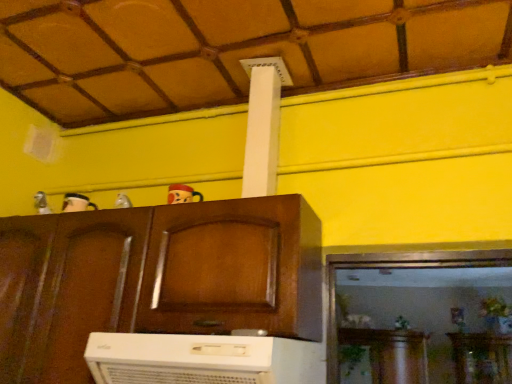
Find the location of a particular element. The height and width of the screenshot is (384, 512). matte plastic toy at upper center, the first toy when ordered from right to left is located at coordinates (182, 194).

What do you see at coordinates (230, 49) in the screenshot?
I see `wooden ceiling at upper center` at bounding box center [230, 49].

This screenshot has width=512, height=384. I want to click on wooden ceiling at upper center, so click(230, 49).

Where is `wooden cabinet at center`? This screenshot has height=384, width=512. wooden cabinet at center is located at coordinates (153, 278).

You are a GUI agent. You are given a task and a screenshot of the screen. Output one action in this format:
    pyautogui.click(x=<x>, y=<y>)
    Task: Click on the white plastic air conditioner at lower center
    
    Given the screenshot: What is the action you would take?
    pyautogui.click(x=202, y=359)

In order to face white plastic air conditioner at lower center, should I rotate leftwards or rightwards?

To face it directly, rotate left by 5.889 degrees.

Find the location of a particular element. The width and height of the screenshot is (512, 384). matte plastic toy at upper center, marked as the second toy in a left-to-right arrangement is located at coordinates tap(182, 194).

Could matte plastic toy at upper center, marked as the second toy in a left-to-right arrangement, be considered to be inside wooden ceiling at upper center?

No, matte plastic toy at upper center, marked as the second toy in a left-to-right arrangement, is located outside of wooden ceiling at upper center.

In the image, is wooden ceiling at upper center positioned in front of or behind matte plastic toy at upper center, marked as the second toy in a left-to-right arrangement?

In the image, wooden ceiling at upper center appears in front of matte plastic toy at upper center, marked as the second toy in a left-to-right arrangement.

Which is farther, (51, 49) or (174, 198)?

The point (174, 198) is behind.

Looking at this image, who is shorter, wooden ceiling at upper center or matte plastic toy at upper center, the first toy when ordered from right to left?

Standing shorter between the two is matte plastic toy at upper center, the first toy when ordered from right to left.

Which object is positioned more to the left, white plastic air conditioner at lower center or metallic silver toy at upper center, acting as the first toy starting from the left?

metallic silver toy at upper center, acting as the first toy starting from the left, is more to the left.

Can you confirm if white plastic air conditioner at lower center is smaller than metallic silver toy at upper center, acting as the first toy starting from the left?

Actually, white plastic air conditioner at lower center might be larger than metallic silver toy at upper center, acting as the first toy starting from the left.

Who is more distant, white plastic air conditioner at lower center or metallic silver toy at upper center, acting as the first toy starting from the left?

metallic silver toy at upper center, acting as the first toy starting from the left, is more distant.

From the picture: How far apart are wooden ceiling at upper center and metallic silver toy at upper center, acting as the first toy starting from the left?

33.19 inches.

Looking at this image, is there a large distance between wooden ceiling at upper center and metallic silver toy at upper center, acting as the first toy starting from the left?

They are positioned close to each other.

Does wooden ceiling at upper center have a greater width compared to metallic silver toy at upper center, acting as the first toy starting from the left?

Correct, the width of wooden ceiling at upper center exceeds that of metallic silver toy at upper center, acting as the first toy starting from the left.

Find the location of a particular element. tile roof lying on the right of metallic silver toy at upper center, acting as the first toy starting from the left is located at coordinates (230, 49).

Which object is closer to the camera, wooden cabinet at center or wooden ceiling at upper center?

wooden cabinet at center.

Between wooden cabinet at center and wooden ceiling at upper center, which one has less height?

wooden ceiling at upper center is shorter.

Considering the positions of objects wooden cabinet at center and wooden ceiling at upper center in the image provided, who is more to the left, wooden cabinet at center or wooden ceiling at upper center?

wooden cabinet at center.

Image resolution: width=512 pixels, height=384 pixels. Identify the location of tile roof above the wooden cabinet at center (from a real-world perspective). [230, 49].

Who is smaller, metallic silver toy at upper center, which ranks as the second toy in right-to-left order, or wooden cabinet at center?

metallic silver toy at upper center, which ranks as the second toy in right-to-left order.

How many degrees apart are the facing directions of metallic silver toy at upper center, acting as the first toy starting from the left, and wooden cabinet at center?

0.00194 degrees.

Could you tell me if metallic silver toy at upper center, which ranks as the second toy in right-to-left order, is turned towards wooden cabinet at center?

No, metallic silver toy at upper center, which ranks as the second toy in right-to-left order, is not oriented towards wooden cabinet at center.

Can we say metallic silver toy at upper center, which ranks as the second toy in right-to-left order, lies outside wooden cabinet at center?

Indeed, metallic silver toy at upper center, which ranks as the second toy in right-to-left order, is completely outside wooden cabinet at center.

Does point (217, 67) appear closer or farther from the camera than point (189, 339)?

Clearly, point (217, 67) is more distant from the camera than point (189, 339).

Is wooden ceiling at upper center placed right next to white plastic air conditioner at lower center?

No, wooden ceiling at upper center is not beside white plastic air conditioner at lower center.

Between wooden ceiling at upper center and white plastic air conditioner at lower center, which one has larger width?

wooden ceiling at upper center.

Is wooden ceiling at upper center not within white plastic air conditioner at lower center?

Yes.

Based on the photo, between matte plastic toy at upper center, the first toy when ordered from right to left, and wooden cabinet at center, which one appears on the right side from the viewer's perspective?

matte plastic toy at upper center, the first toy when ordered from right to left.

Which object is thinner, matte plastic toy at upper center, marked as the second toy in a left-to-right arrangement, or wooden cabinet at center?

With smaller width is matte plastic toy at upper center, marked as the second toy in a left-to-right arrangement.

How many degrees apart are the facing directions of matte plastic toy at upper center, the first toy when ordered from right to left, and wooden cabinet at center?

The angle between the facing direction of matte plastic toy at upper center, the first toy when ordered from right to left, and the facing direction of wooden cabinet at center is 0.000503 degrees.

Does point (177, 199) lie in front of point (46, 283)?

No, (177, 199) is behind (46, 283).

Image resolution: width=512 pixels, height=384 pixels. Identify the location of toy that is the 1st one when counting backward from the wooden ceiling at upper center. (182, 194).

Locate an element on the screen. This screenshot has height=384, width=512. toy that is the 1st one when counting upward from the white plastic air conditioner at lower center (from the image's perspective) is located at coordinates (123, 201).

Estimate the real-world distances between objects in this image. Which object is closer to metallic silver toy at upper center, acting as the first toy starting from the left, wooden cabinet at center or matte plastic toy at upper center, marked as the second toy in a left-to-right arrangement?

Based on the image, matte plastic toy at upper center, marked as the second toy in a left-to-right arrangement, appears to be nearer to metallic silver toy at upper center, acting as the first toy starting from the left.

Estimate the real-world distances between objects in this image. Which object is further from matte plastic toy at upper center, the first toy when ordered from right to left, wooden cabinet at center or wooden ceiling at upper center?

wooden ceiling at upper center is further to matte plastic toy at upper center, the first toy when ordered from right to left.

When comparing their distances from metallic silver toy at upper center, acting as the first toy starting from the left, does wooden ceiling at upper center or matte plastic toy at upper center, the first toy when ordered from right to left, seem further?

wooden ceiling at upper center is further to metallic silver toy at upper center, acting as the first toy starting from the left.

Looking at the image, which one is located closer to wooden cabinet at center, metallic silver toy at upper center, acting as the first toy starting from the left, or wooden ceiling at upper center?

Based on the image, metallic silver toy at upper center, acting as the first toy starting from the left, appears to be nearer to wooden cabinet at center.

Based on their spatial positions, is white plastic air conditioner at lower center or matte plastic toy at upper center, marked as the second toy in a left-to-right arrangement, further from metallic silver toy at upper center, acting as the first toy starting from the left?

Based on the image, white plastic air conditioner at lower center appears to be further to metallic silver toy at upper center, acting as the first toy starting from the left.

Based on their spatial positions, is wooden ceiling at upper center or metallic silver toy at upper center, which ranks as the second toy in right-to-left order, further from wooden cabinet at center?

The object further to wooden cabinet at center is wooden ceiling at upper center.

From the image, which object appears to be farther from wooden ceiling at upper center, wooden cabinet at center or white plastic air conditioner at lower center?

white plastic air conditioner at lower center is positioned further to the anchor wooden ceiling at upper center.

From the image, which object appears to be farther from wooden ceiling at upper center, matte plastic toy at upper center, the first toy when ordered from right to left, or white plastic air conditioner at lower center?

The object further to wooden ceiling at upper center is white plastic air conditioner at lower center.

What are the coordinates of `cabinetry between white plastic air conditioner at lower center and metallic silver toy at upper center, acting as the first toy starting from the left, from front to back` in the screenshot? It's located at (153, 278).

At what (x,y) coordinates should I click in order to perform the action: click on toy between wooden ceiling at upper center and metallic silver toy at upper center, which ranks as the second toy in right-to-left order, in the vertical direction. Please return your answer as a coordinate pair (x, y). Looking at the image, I should click on (182, 194).

Identify the location of cabinetry between wooden ceiling at upper center and white plastic air conditioner at lower center in the up-down direction. (153, 278).

At what (x,y) coordinates should I click in order to perform the action: click on toy between white plastic air conditioner at lower center and metallic silver toy at upper center, acting as the first toy starting from the left, along the z-axis. Please return your answer as a coordinate pair (x, y). The width and height of the screenshot is (512, 384). Looking at the image, I should click on (182, 194).